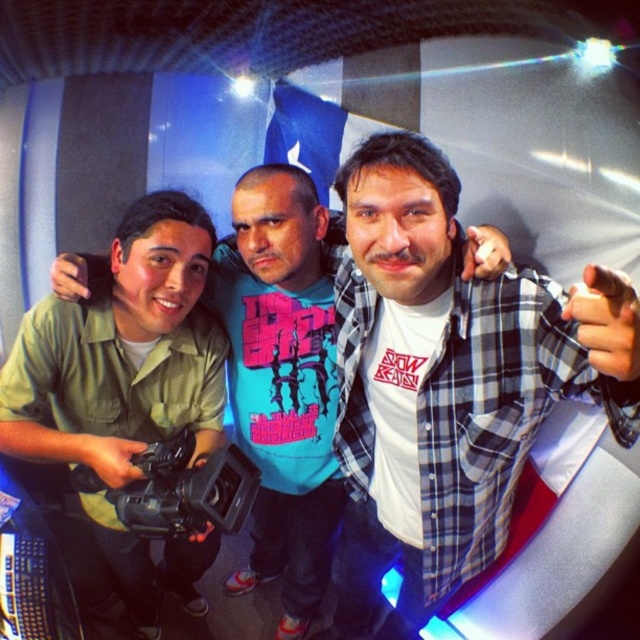
Based on the photo, you are organizing a photo shoot and need to ensure that the plaid shirt at center and the black plastic camera at center fit within a rectangular frame. Based on their sizes, which object would require more horizontal space to fully capture in the frame?

The black plastic camera at center requires more horizontal space because its width is greater than the plaid shirt at center.

In the scene described, there are a plaid shirt at center and a black plastic camera at center. From the perspective of someone facing the scene, which object is positioned to the right of the other?

The plaid shirt at center is to the right of the black plastic camera at center.

You are standing in the room and want to take a photo of the green matte shirt at left and the black plastic camera at center. Which object is closer to the left side of the room?

The black plastic camera at center is closer to the left side of the room because the green matte shirt at left is to the right of it.